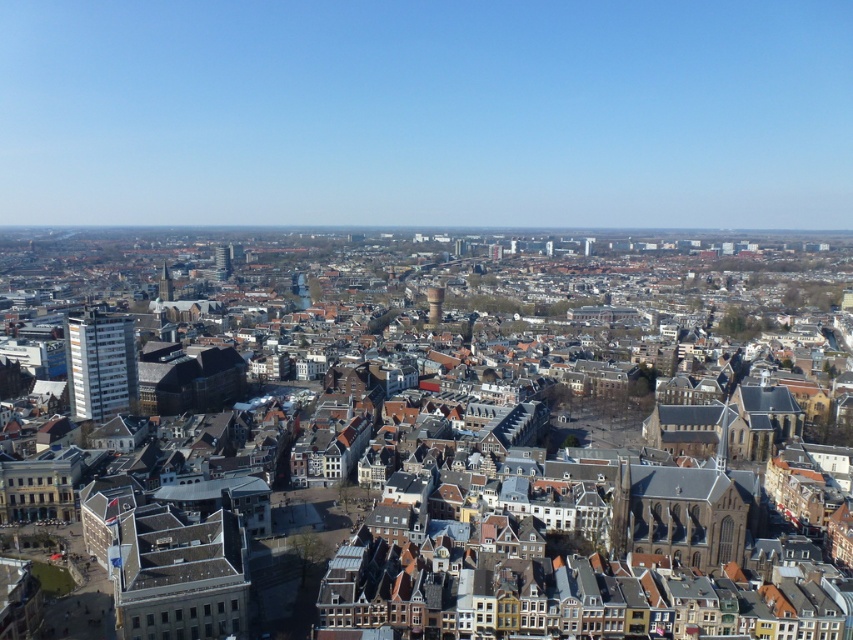
Is matte gray tower at center taller than smooth concrete tower at center?

No.

Does matte gray tower at center appear under smooth concrete tower at center?

Actually, matte gray tower at center is above smooth concrete tower at center.

Is point (228, 260) farther from camera compared to point (436, 314)?

Yes, point (228, 260) is farther from viewer.

This screenshot has width=853, height=640. I want to click on matte gray tower at center, so click(x=222, y=262).

Image resolution: width=853 pixels, height=640 pixels. Find the location of `smooth concrete tower at center`. smooth concrete tower at center is located at coordinates (434, 304).

Between point (442, 292) and point (161, 292), which one is positioned in front?

Point (442, 292)

Is point (436, 298) positioned in front of point (164, 292)?

Yes, point (436, 298) is in front of point (164, 292).

Locate an element on the screen. The image size is (853, 640). smooth concrete tower at center is located at coordinates (434, 304).

Can you confirm if white glossy building at left is positioned below smooth concrete tower at center?

Yes.

Locate an element on the screen. The image size is (853, 640). white glossy building at left is located at coordinates (100, 364).

This screenshot has width=853, height=640. What are the coordinates of `white glossy building at left` in the screenshot? It's located at (100, 364).